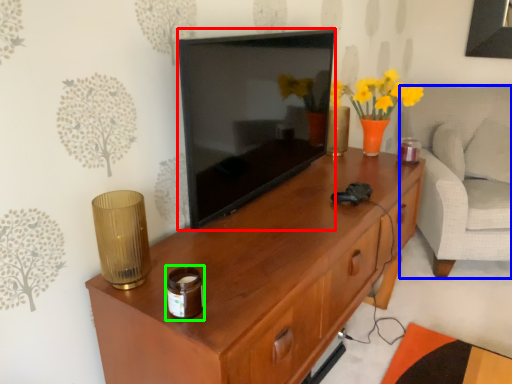
Question: Which is farther away from television (highlighted by a red box)? armchair (highlighted by a blue box) or candle holder (highlighted by a green box)?

Choices:
 (A) armchair
 (B) candle holder

Answer: (A)